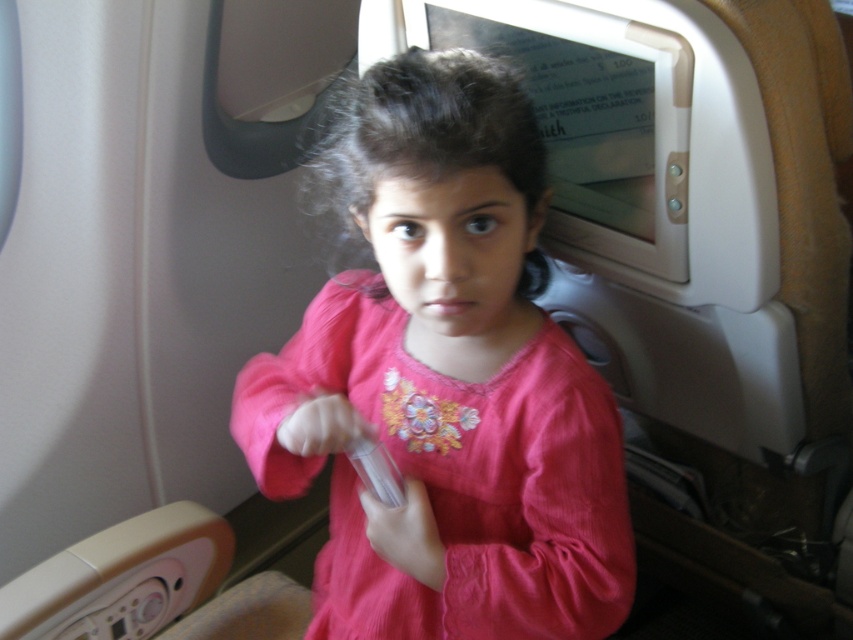
Does point (407, 124) come in front of point (350, 444)?

Yes, it is in front of point (350, 444).

This screenshot has width=853, height=640. What do you see at coordinates (445, 381) in the screenshot?
I see `pink cotton shirt at center` at bounding box center [445, 381].

Find the location of a particular element. This screenshot has width=853, height=640. pink cotton shirt at center is located at coordinates (445, 381).